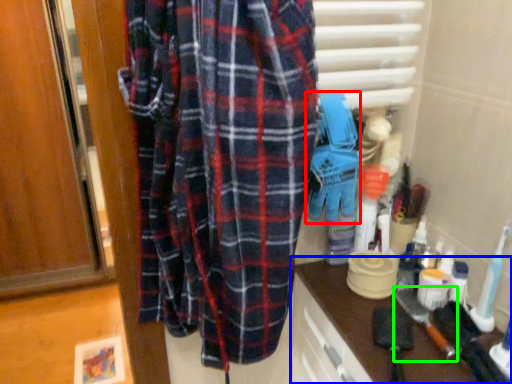
Question: Which object is positioned farthest from toy (highlighted by a red box)? Select from counter (highlighted by a blue box) and brush (highlighted by a green box).

Choices:
 (A) counter
 (B) brush

Answer: (B)